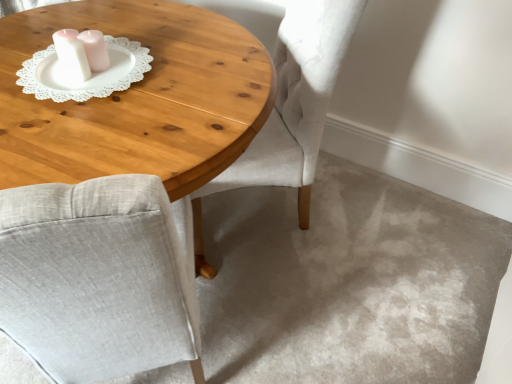
Question: Is light gray fabric chair at center not inside wooden coffee table at center?

Choices:
 (A) yes
 (B) no

Answer: (B)

Question: From the image's perspective, is light gray fabric chair at center below wooden coffee table at center?

Choices:
 (A) no
 (B) yes

Answer: (A)

Question: Does light gray fabric chair at center have a lesser height compared to wooden coffee table at center?

Choices:
 (A) no
 (B) yes

Answer: (A)

Question: Considering the relative sizes of light gray fabric chair at center and wooden coffee table at center in the image provided, is light gray fabric chair at center taller than wooden coffee table at center?

Choices:
 (A) no
 (B) yes

Answer: (B)

Question: Is light gray fabric chair at center thinner than wooden coffee table at center?

Choices:
 (A) yes
 (B) no

Answer: (A)

Question: Is point (212, 170) positioned closer to the camera than point (42, 61)?

Choices:
 (A) closer
 (B) farther

Answer: (A)

Question: Considering the positions of wooden coffee table at center and white lace doily at upper left in the image, is wooden coffee table at center taller or shorter than white lace doily at upper left?

Choices:
 (A) tall
 (B) short

Answer: (A)

Question: Relative to white lace doily at upper left, is wooden coffee table at center in front or behind?

Choices:
 (A) behind
 (B) front

Answer: (B)

Question: Would you say wooden coffee table at center is to the left or to the right of white lace doily at upper left in the picture?

Choices:
 (A) right
 (B) left

Answer: (B)

Question: Considering their positions, is light gray fabric chair at center located in front of or behind wooden coffee table at center?

Choices:
 (A) behind
 (B) front

Answer: (A)

Question: In terms of width, does light gray fabric chair at center look wider or thinner when compared to wooden coffee table at center?

Choices:
 (A) wide
 (B) thin

Answer: (B)

Question: Is light gray fabric chair at center bigger or smaller than wooden coffee table at center?

Choices:
 (A) small
 (B) big

Answer: (A)

Question: From the image's perspective, is light gray fabric chair at center located above or below wooden coffee table at center?

Choices:
 (A) above
 (B) below

Answer: (A)

Question: Is wooden coffee table at center inside the boundaries of light gray fabric chair at center, or outside?

Choices:
 (A) inside
 (B) outside

Answer: (B)

Question: Considering the relative positions of wooden coffee table at center and light gray fabric chair at center in the image provided, is wooden coffee table at center to the left or to the right of light gray fabric chair at center?

Choices:
 (A) left
 (B) right

Answer: (A)